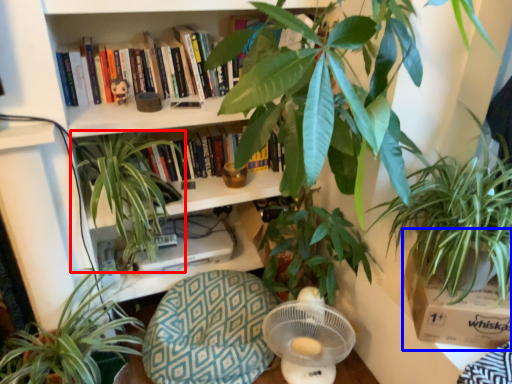
Question: Which object appears closest to the camera in this image, houseplant (highlighted by a red box) or cardboard box (highlighted by a blue box)?

Choices:
 (A) houseplant
 (B) cardboard box

Answer: (B)